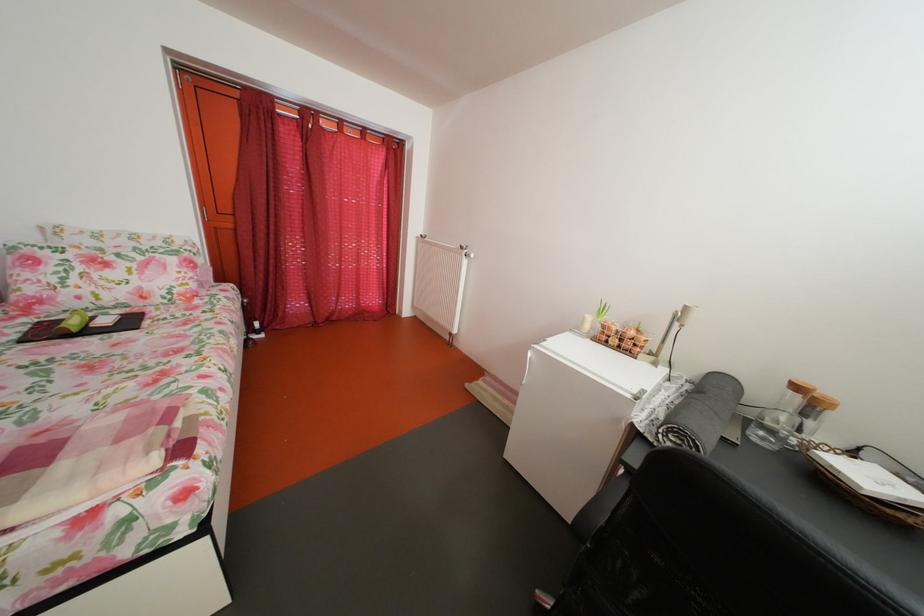
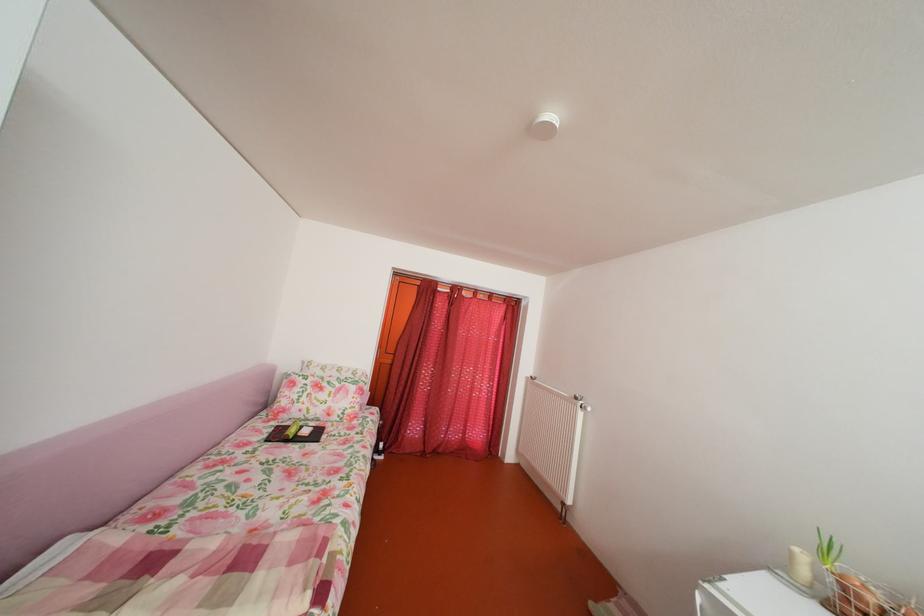
Where in the second image is the point corresponding to (83,330) from the first image?

(304, 438)